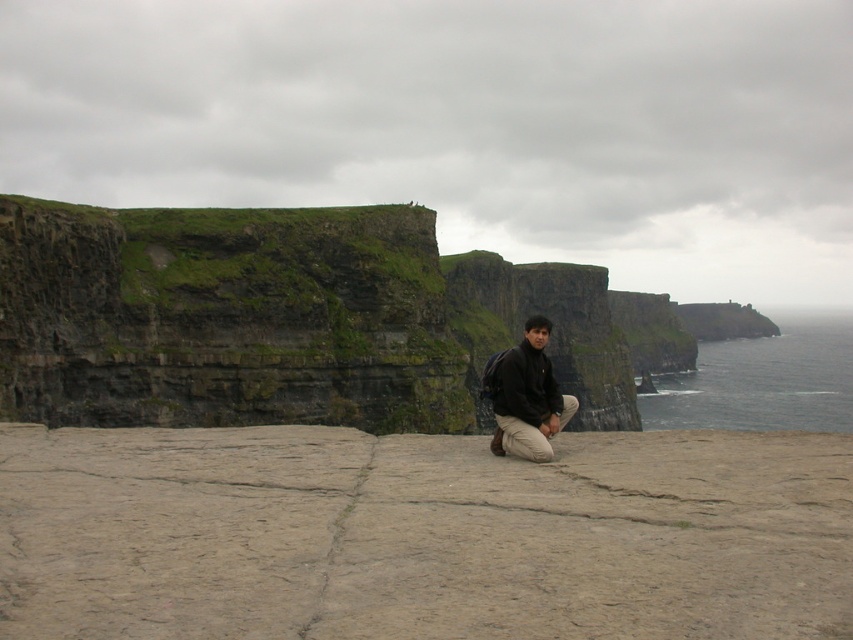
From the picture: You are a photographer trying to capture a wide shot of the scene. You notice the brown stone at center and the dark brown leather jacket at center. Which object is wider in the image?

The brown stone at center is wider than the dark brown leather jacket at center according to the description.

You are a photographer trying to capture the scene with the brown stone at center and the dark brown leather jacket at center. Which object is closer to the camera?

The dark brown leather jacket at center is closer to the camera because the brown stone at center is positioned under it.

You are a photographer trying to capture a closeup of the brown stone at center while also including the dark brown leather jacket at center in the frame. Based on their sizes, which object should you focus on first to ensure both are in focus?

The brown stone at center is larger than the dark brown leather jacket at center, so focusing on the brown stone at center first will help ensure both are in focus since it takes up more space in the frame.